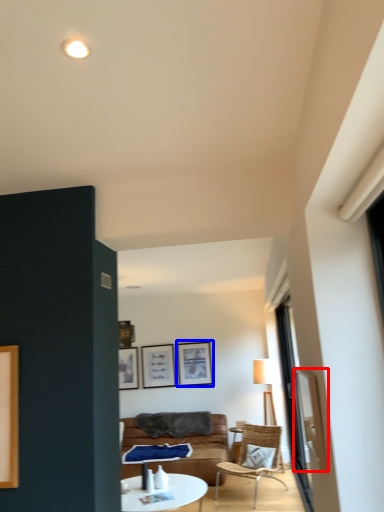
Question: Among these objects, which one is nearest to the camera, window screen (highlighted by a red box) or picture frame (highlighted by a blue box)?

Choices:
 (A) window screen
 (B) picture frame

Answer: (A)